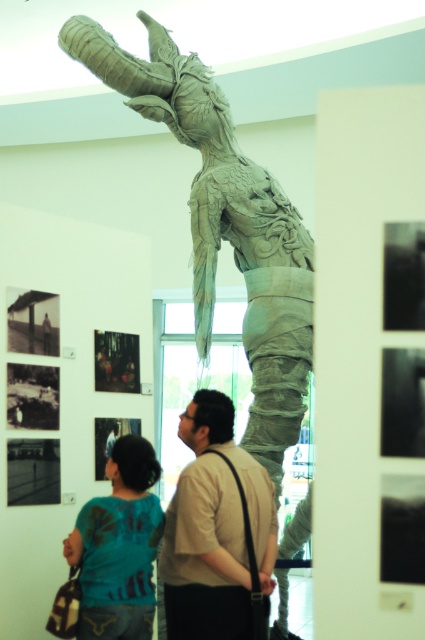
You are standing in the art gallery and want to take a photo of the sculpture. You notice two points on the sculpture marked as point 1 at coordinates point (261,362) and point 2 at coordinates point (133,612). Which point is closer to your camera when taking the photo?

Point (261,362) is further to the camera than point (133,612), so point (133,612) is closer to the camera.

You are a photographer trying to capture both the light brown leather shirt at center and the teal fabric shirt at lower left in a single frame. Which shirt should you focus on to ensure both are in the frame without moving the camera?

You should focus on the light brown leather shirt at center since it is larger in size than the teal fabric shirt at lower left, making it easier to include both in the frame.